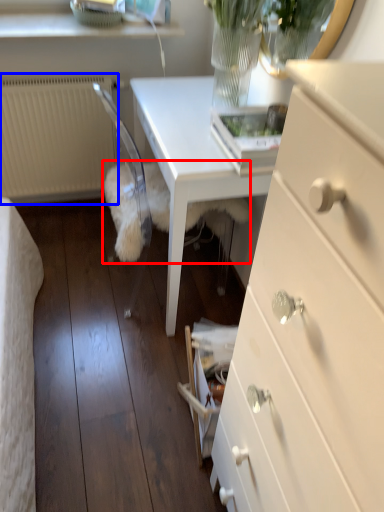
Question: Among these objects, which one is nearest to the camera, animal (highlighted by a red box) or radiator (highlighted by a blue box)?

Choices:
 (A) animal
 (B) radiator

Answer: (A)